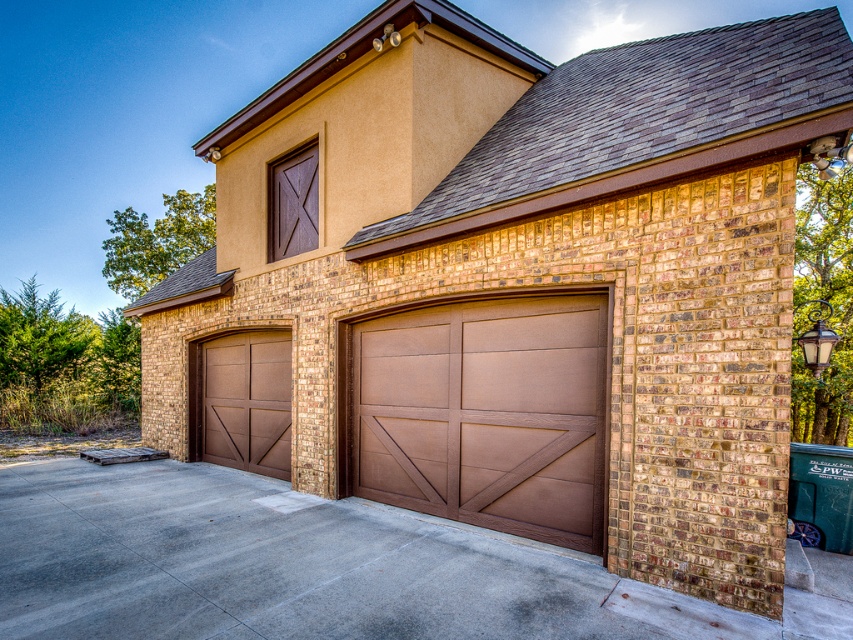
Question: Can you confirm if brown woodgrain garage door at center is positioned below brown wood door at left?

Choices:
 (A) yes
 (B) no

Answer: (B)

Question: Is brown woodgrain garage door at center wider than brown wood door at left?

Choices:
 (A) yes
 (B) no

Answer: (A)

Question: Which point is closer to the camera?

Choices:
 (A) (374, 400)
 (B) (200, 371)

Answer: (A)

Question: Which object appears farthest from the camera in this image?

Choices:
 (A) brown wood door at left
 (B) brown woodgrain garage door at center

Answer: (A)

Question: Is brown woodgrain garage door at center to the left of brown wood door at left from the viewer's perspective?

Choices:
 (A) yes
 (B) no

Answer: (B)